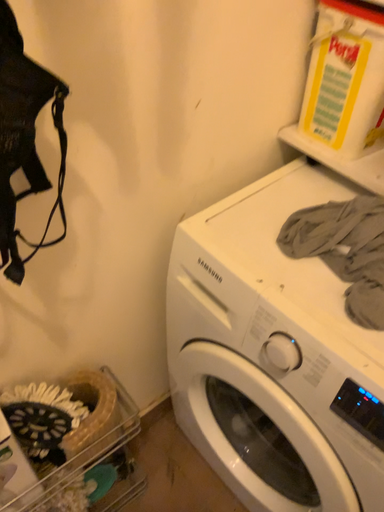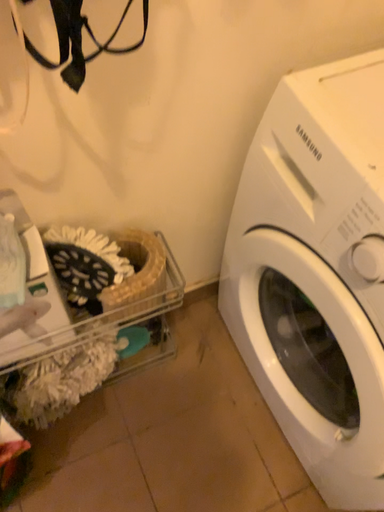
Question: Which way did the camera rotate in the video?

Choices:
 (A) rotated upward
 (B) rotated downward

Answer: (B)